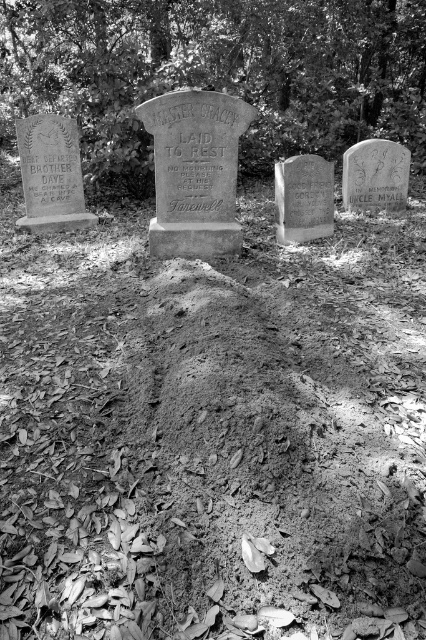
Between point (192, 220) and point (348, 172), which one is positioned behind?

Point (348, 172)

Image resolution: width=426 pixels, height=640 pixels. Describe the element at coordinates (195, 172) in the screenshot. I see `smooth stone gravestone at center` at that location.

Who is more distant from viewer, (198, 147) or (394, 196)?

Point (394, 196)

You are a GUI agent. You are given a task and a screenshot of the screen. Output one action in this format:
    pyautogui.click(x=<x>, y=<y>)
    Task: Click on the smooth stone gravestone at center
    The width and height of the screenshot is (426, 640).
    Given the screenshot: What is the action you would take?
    pyautogui.click(x=195, y=172)

Can you confirm if smooth gray stone at center is wider than smooth gray stone gravestone at center?

Incorrect, smooth gray stone at center's width does not surpass smooth gray stone gravestone at center's.

Who is more forward, (313, 161) or (345, 173)?

Point (313, 161)

Does point (322, 172) come in front of point (357, 161)?

Yes, point (322, 172) is in front of point (357, 161).

Where is `smooth gray stone at center`? The width and height of the screenshot is (426, 640). smooth gray stone at center is located at coordinates (304, 198).

Between point (141, 179) and point (77, 147), which one is positioned behind?

Positioned behind is point (141, 179).

Who is taller, smooth bark tree at upper center or matte stone gravestone at left?

matte stone gravestone at left

Is point (414, 115) positioned behind point (45, 204)?

Yes.

At what (x,y) coordinates should I click in order to perform the action: click on smooth bark tree at upper center. Please return your answer as a coordinate pair (x, y). Looking at the image, I should click on (216, 74).